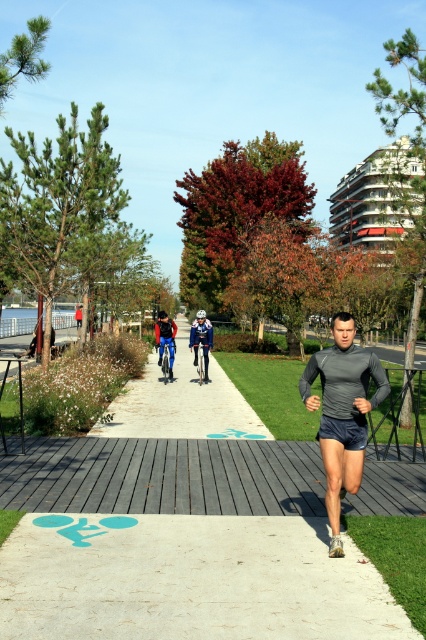
You are a photographer standing at the camera position. You want to capture a photo of the blue fabric at center. However, there is a man running towards you. The man is currently 10 meters away from you. If the man is running at a speed of 5 meters per second, and you need to wait 2 seconds before you can safely take the photo, will the man be in the way when you take the photo?

The blue fabric at center is 9.66 meters away from the camera. The man is currently 10 meters away and running towards the camera at 5 meters per second. In 2 seconds, the man will have covered 10 meters, reaching the camera position. However, since the blue fabric is 9.66 meters away, the man would have already passed the fabric location and be at the camera position when you take the photo. Therefore, the man will be in the way of the photo.